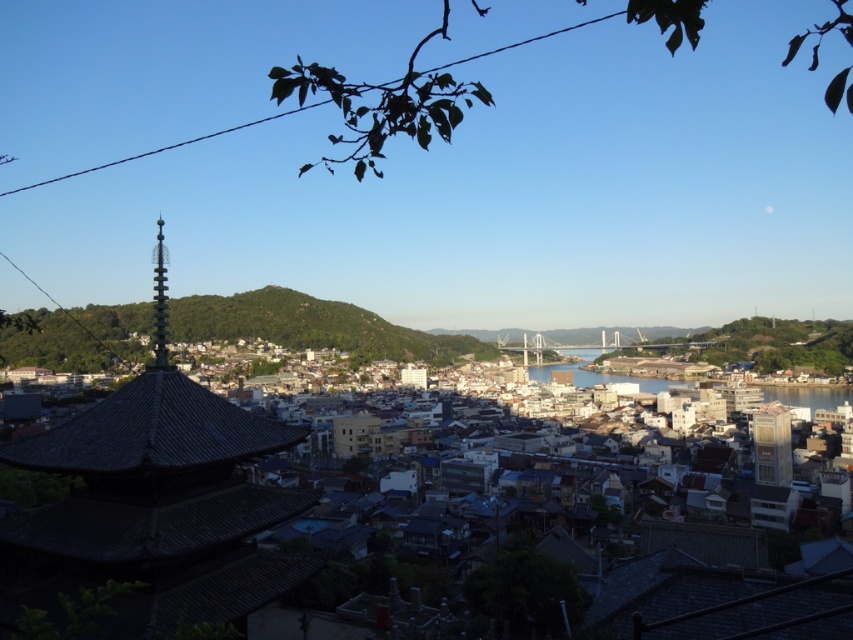
You are standing at the base of the green grassy hill at center and want to reach the clear water at center. Which direction should you walk to get there?

Since the green grassy hill at center is much taller than the clear water at center, you should walk downhill to reach the clear water at center.

You are a city planner evaluating the space between the dark gray stone pagoda at lower left and the clear water at center. Based on their sizes, which one would require more area to accommodate a new public seating area?

The clear water at center requires more area to accommodate a new public seating area because it is larger than the dark gray stone pagoda at lower left.